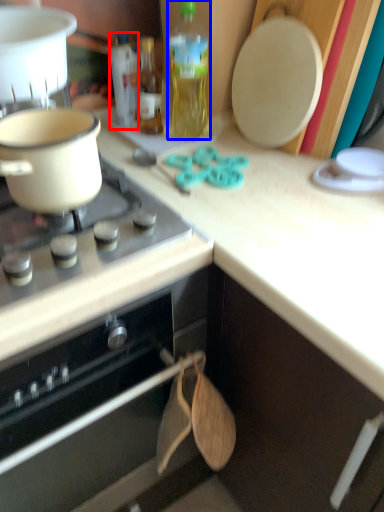
Question: Which of the following is the farthest to the observer, bottle (highlighted by a red box) or bottle (highlighted by a blue box)?

Choices:
 (A) bottle
 (B) bottle

Answer: (A)